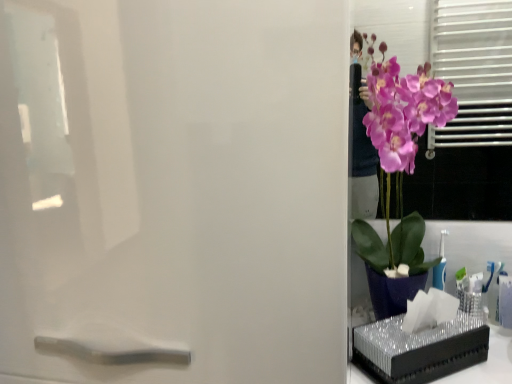
Question: Does satin white screen door at right have a greater height compared to purple glossy orchid at right?

Choices:
 (A) yes
 (B) no

Answer: (A)

Question: From a real-world perspective, is satin white screen door at right located beneath purple glossy orchid at right?

Choices:
 (A) no
 (B) yes

Answer: (B)

Question: From the image's perspective, is satin white screen door at right on purple glossy orchid at right?

Choices:
 (A) no
 (B) yes

Answer: (A)

Question: Would you say satin white screen door at right is outside purple glossy orchid at right?

Choices:
 (A) no
 (B) yes

Answer: (B)

Question: Is satin white screen door at right oriented towards purple glossy orchid at right?

Choices:
 (A) no
 (B) yes

Answer: (A)

Question: Considering the positions of satin white screen door at right and purple glossy orchid at right in the image, is satin white screen door at right bigger or smaller than purple glossy orchid at right?

Choices:
 (A) big
 (B) small

Answer: (A)

Question: From a real-world perspective, is satin white screen door at right positioned above or below purple glossy orchid at right?

Choices:
 (A) above
 (B) below

Answer: (B)

Question: From the image's perspective, is satin white screen door at right located above or below purple glossy orchid at right?

Choices:
 (A) below
 (B) above

Answer: (A)

Question: In terms of height, does satin white screen door at right look taller or shorter compared to purple glossy orchid at right?

Choices:
 (A) tall
 (B) short

Answer: (A)

Question: From the image's perspective, is metallic silver tissue box at right above or below purple glossy orchid at right?

Choices:
 (A) above
 (B) below

Answer: (B)

Question: In terms of width, does metallic silver tissue box at right look wider or thinner when compared to purple glossy orchid at right?

Choices:
 (A) wide
 (B) thin

Answer: (B)

Question: Is point (463, 375) positioned closer to the camera than point (378, 74)?

Choices:
 (A) closer
 (B) farther

Answer: (A)

Question: Based on their sizes in the image, would you say metallic silver tissue box at right is bigger or smaller than purple glossy orchid at right?

Choices:
 (A) small
 (B) big

Answer: (A)

Question: From a real-world perspective, is purple glossy orchid at right above or below metallic silver tissue box at right?

Choices:
 (A) above
 (B) below

Answer: (A)

Question: Considering the relative positions of purple glossy orchid at right and metallic silver tissue box at right in the image provided, is purple glossy orchid at right to the left or to the right of metallic silver tissue box at right?

Choices:
 (A) right
 (B) left

Answer: (B)